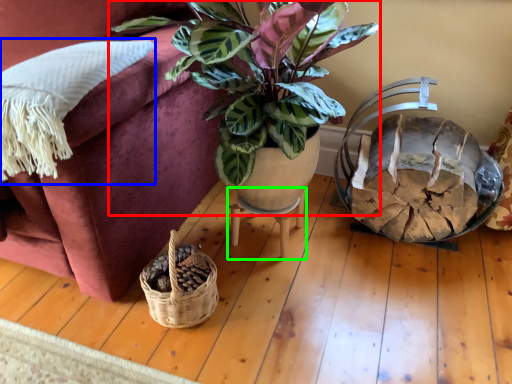
Question: Which object is positioned farthest from houseplant (highlighted by a red box)? Select from pillow (highlighted by a blue box) and table (highlighted by a green box).

Choices:
 (A) pillow
 (B) table

Answer: (B)